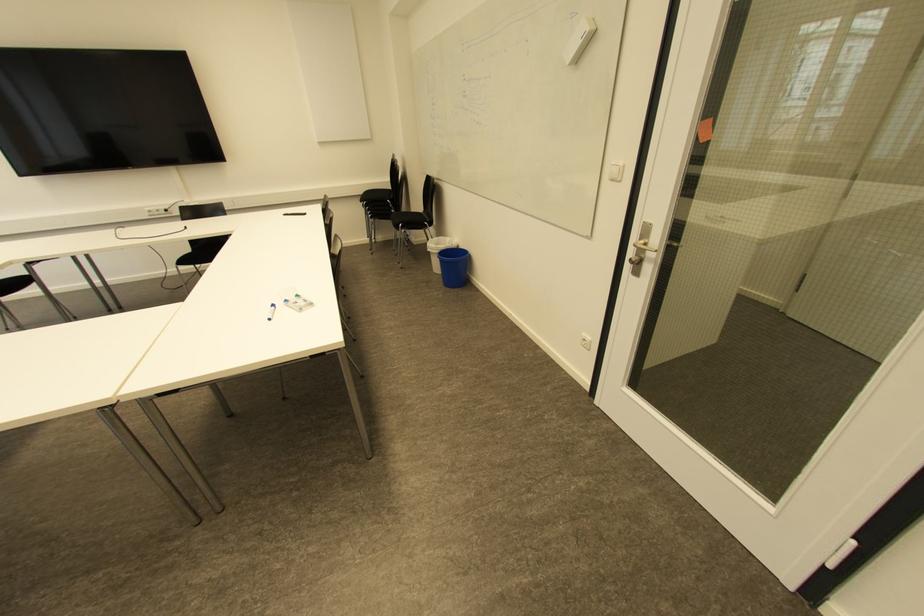
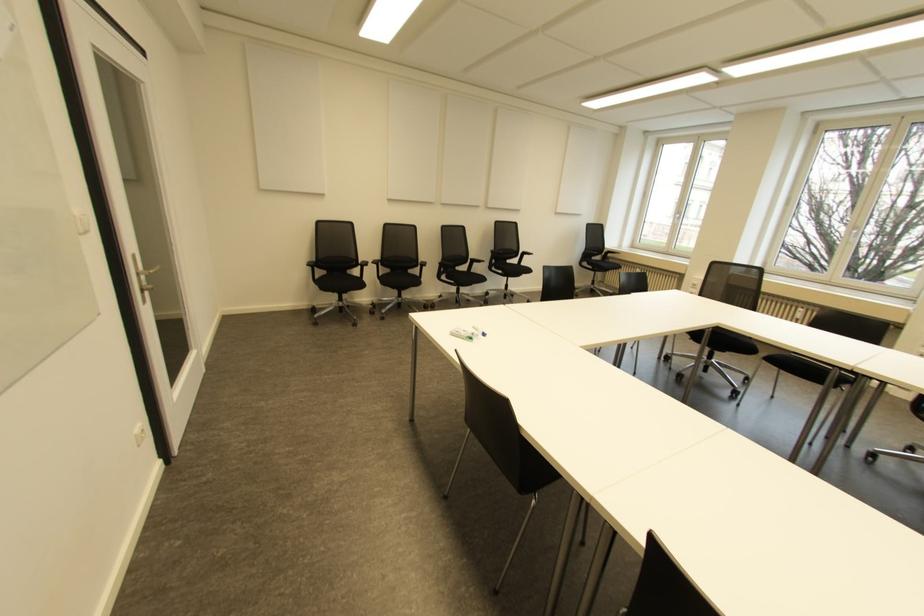
Where in the second image is the point corresponding to (297,294) from the first image?

(470, 338)